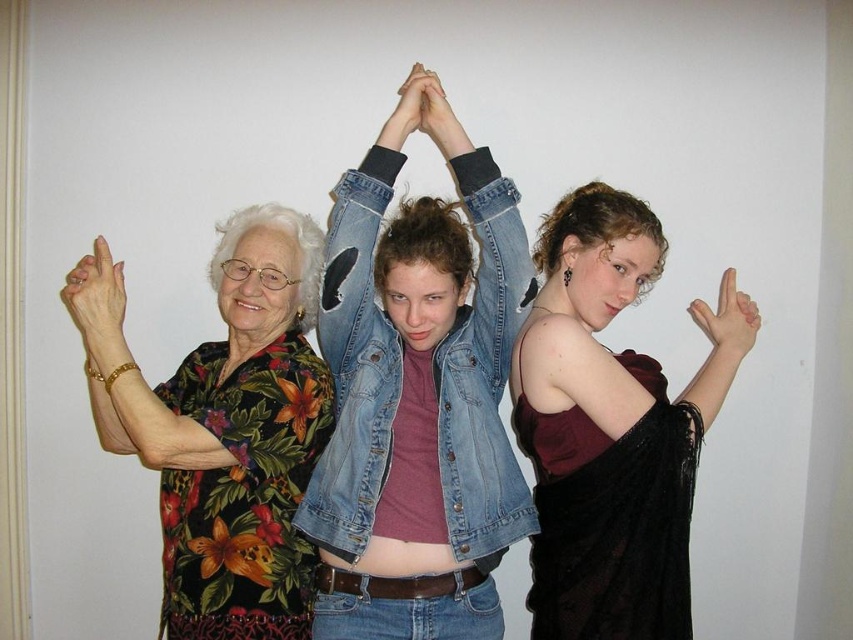
Is point (700, 321) positioned before point (416, 72)?

No, (700, 321) is behind (416, 72).

You are a GUI agent. You are given a task and a screenshot of the screen. Output one action in this format:
    pyautogui.click(x=<x>, y=<y>)
    Task: Click on the black matte hand at upper right
    This screenshot has width=853, height=640.
    Given the screenshot: What is the action you would take?
    pyautogui.click(x=720, y=346)

This screenshot has height=640, width=853. Identify the location of black matte hand at upper right. 720,346.

Does velvet maroon dress at center appear on the left side of floral-patterned shirt at left?

Incorrect, velvet maroon dress at center is not on the left side of floral-patterned shirt at left.

Does velvet maroon dress at center come in front of floral-patterned shirt at left?

No, velvet maroon dress at center is behind floral-patterned shirt at left.

Is point (657, 387) positioned behind point (184, 436)?

That is True.

Locate an element on the screen. velvet maroon dress at center is located at coordinates (612, 426).

Which is above, floral print shirt at left or matte gold ring at upper left?

Positioned higher is matte gold ring at upper left.

Can you confirm if floral print shirt at left is thinner than matte gold ring at upper left?

No, floral print shirt at left is not thinner than matte gold ring at upper left.

Measure the distance between point (x=193, y=420) and camera.

5.39 feet

The height and width of the screenshot is (640, 853). Find the location of `floral print shirt at left`. floral print shirt at left is located at coordinates (223, 426).